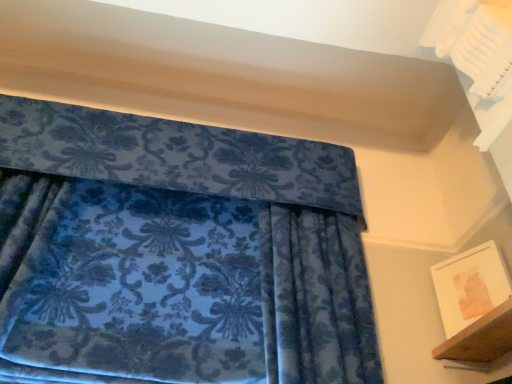
Question: From a real-world perspective, is wooden shelf at lower right positioned under white matte picture frame at lower right based on gravity?

Choices:
 (A) yes
 (B) no

Answer: (A)

Question: Considering the relative sizes of wooden shelf at lower right and white matte picture frame at lower right in the image provided, is wooden shelf at lower right smaller than white matte picture frame at lower right?

Choices:
 (A) yes
 (B) no

Answer: (B)

Question: Is white matte picture frame at lower right surrounded by wooden shelf at lower right?

Choices:
 (A) no
 (B) yes

Answer: (A)

Question: From the image's perspective, is wooden shelf at lower right below white matte picture frame at lower right?

Choices:
 (A) yes
 (B) no

Answer: (A)

Question: Is wooden shelf at lower right at the right side of white matte picture frame at lower right?

Choices:
 (A) no
 (B) yes

Answer: (A)

Question: Is wooden shelf at lower right thinner than white matte picture frame at lower right?

Choices:
 (A) no
 (B) yes

Answer: (A)

Question: Does white matte picture frame at lower right have a lesser width compared to wooden shelf at lower right?

Choices:
 (A) no
 (B) yes

Answer: (B)

Question: Is white matte picture frame at lower right positioned beyond the bounds of wooden shelf at lower right?

Choices:
 (A) no
 (B) yes

Answer: (B)

Question: From the image's perspective, is white matte picture frame at lower right beneath wooden shelf at lower right?

Choices:
 (A) yes
 (B) no

Answer: (B)

Question: Can you confirm if white matte picture frame at lower right is taller than wooden shelf at lower right?

Choices:
 (A) no
 (B) yes

Answer: (B)

Question: Does white matte picture frame at lower right have a greater width compared to wooden shelf at lower right?

Choices:
 (A) yes
 (B) no

Answer: (B)

Question: From a real-world perspective, does white matte picture frame at lower right stand above wooden shelf at lower right?

Choices:
 (A) no
 (B) yes

Answer: (B)

Question: From the image's perspective, is white matte picture frame at lower right located above or below wooden shelf at lower right?

Choices:
 (A) below
 (B) above

Answer: (B)